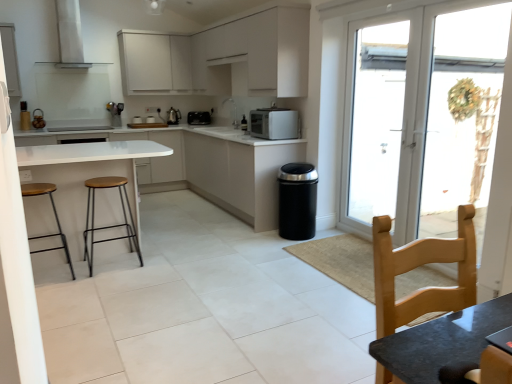
Question: Is the depth of white matte cabinetry at center, the first cabinetry from the bottom, less than that of light wood chair at lower right?

Choices:
 (A) no
 (B) yes

Answer: (A)

Question: Can you confirm if white matte cabinetry at center, the fourth cabinetry positioned from the top, is smaller than light wood chair at lower right?

Choices:
 (A) yes
 (B) no

Answer: (B)

Question: Is white matte cabinetry at center, the fourth cabinetry positioned from the top, not within light wood chair at lower right?

Choices:
 (A) no
 (B) yes

Answer: (B)

Question: Is white matte cabinetry at center, the fourth cabinetry positioned from the top, to the right of light wood chair at lower right from the viewer's perspective?

Choices:
 (A) no
 (B) yes

Answer: (A)

Question: Can you confirm if white matte cabinetry at center, the first cabinetry from the bottom, is positioned to the left of light wood chair at lower right?

Choices:
 (A) yes
 (B) no

Answer: (A)

Question: Is transparent glass door at right inside the boundaries of white matte cabinet at upper center, acting as the 1th cabinetry starting from the top, or outside?

Choices:
 (A) outside
 (B) inside

Answer: (A)

Question: Is point (373, 102) closer or farther from the camera than point (159, 41)?

Choices:
 (A) farther
 (B) closer

Answer: (B)

Question: From a real-world perspective, relative to white matte cabinet at upper center, the fourth cabinetry in the bottom-to-top sequence, is transparent glass door at right vertically above or below?

Choices:
 (A) above
 (B) below

Answer: (B)

Question: Looking at the image, does transparent glass door at right seem bigger or smaller compared to white matte cabinet at upper center, acting as the 1th cabinetry starting from the top?

Choices:
 (A) small
 (B) big

Answer: (A)

Question: From a real-world perspective, is metallic silver toaster at center physically located above or below white matte cabinetry at center, the fourth cabinetry positioned from the top?

Choices:
 (A) below
 (B) above

Answer: (B)

Question: Considering the positions of metallic silver toaster at center and white matte cabinetry at center, the first cabinetry from the bottom, in the image, is metallic silver toaster at center bigger or smaller than white matte cabinetry at center, the first cabinetry from the bottom,?

Choices:
 (A) big
 (B) small

Answer: (B)

Question: Is metallic silver toaster at center taller or shorter than white matte cabinetry at center, the fourth cabinetry positioned from the top?

Choices:
 (A) short
 (B) tall

Answer: (A)

Question: Considering the positions of point (138, 119) and point (144, 172), is point (138, 119) closer or farther from the camera than point (144, 172)?

Choices:
 (A) farther
 (B) closer

Answer: (A)

Question: In terms of size, does light wood chair at lower right appear bigger or smaller than wooden seat stool at left, positioned as the 2th stool in right-to-left order?

Choices:
 (A) big
 (B) small

Answer: (A)

Question: In the image, is light wood chair at lower right positioned in front of or behind wooden seat stool at left, placed as the first stool when sorted from left to right?

Choices:
 (A) behind
 (B) front

Answer: (B)